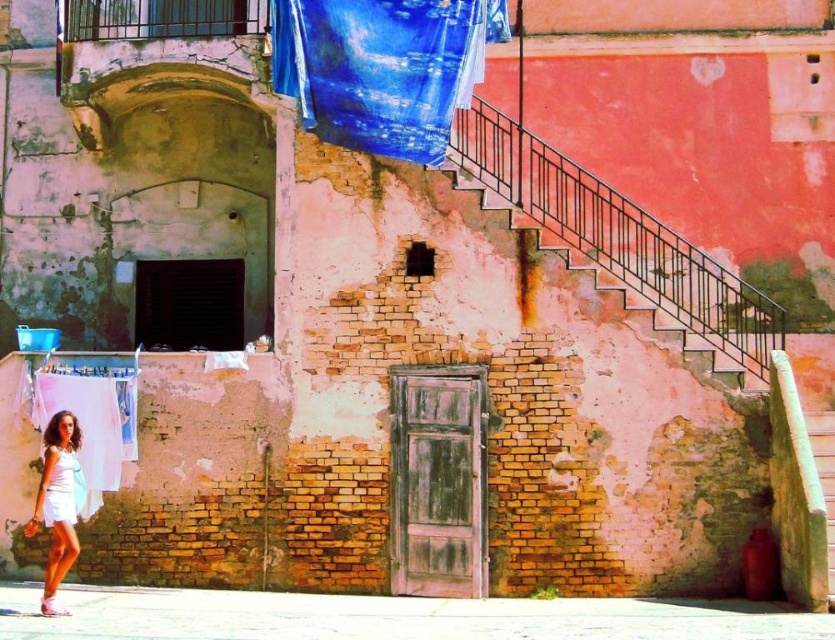
In the scene shown: Who is more distant from viewer, (79, 374) or (62, 467)?

The point (79, 374) is more distant.

The height and width of the screenshot is (640, 835). What do you see at coordinates (90, 417) in the screenshot?
I see `white fabric at lower left` at bounding box center [90, 417].

Where is `white fabric at lower left`? The image size is (835, 640). white fabric at lower left is located at coordinates (90, 417).

From the picture: Is rusty metal stairs at center taller than white matte dress at lower left?

Yes, rusty metal stairs at center is taller than white matte dress at lower left.

Is rusty metal stairs at center to the left of white matte dress at lower left from the viewer's perspective?

Incorrect, rusty metal stairs at center is not on the left side of white matte dress at lower left.

Who is more forward, (641, 259) or (42, 508)?

Positioned in front is point (42, 508).

The width and height of the screenshot is (835, 640). What are the coordinates of `rusty metal stairs at center` in the screenshot? It's located at (631, 253).

Does blue fabric at upper center appear over white fabric at lower left?

Yes, blue fabric at upper center is above white fabric at lower left.

Which is behind, point (393, 104) or point (43, 420)?

The point (43, 420) is more distant.

Identify the location of blue fabric at upper center. (382, 67).